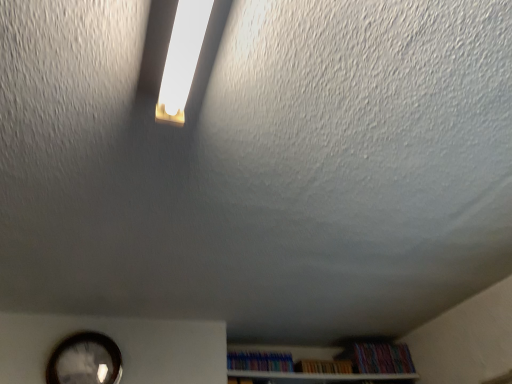
Question: Should I look upward or downward to see multicolored plastic books at lower center, the 1th book from the left?

Choices:
 (A) down
 (B) up

Answer: (A)

Question: Considering the relative sizes of matte black clock at lower left and multicolored paperbacks at lower right, positioned as the 1th book in right-to-left order, in the image provided, is matte black clock at lower left bigger than multicolored paperbacks at lower right, positioned as the 1th book in right-to-left order,?

Choices:
 (A) yes
 (B) no

Answer: (B)

Question: Is matte black clock at lower left completely or partially outside of multicolored paperbacks at lower right, which appears as the 3th book when viewed from the left?

Choices:
 (A) yes
 (B) no

Answer: (A)

Question: Considering the relative positions of matte black clock at lower left and multicolored paperbacks at lower right, which appears as the 3th book when viewed from the left, in the image provided, is matte black clock at lower left to the left of multicolored paperbacks at lower right, which appears as the 3th book when viewed from the left, from the viewer's perspective?

Choices:
 (A) no
 (B) yes

Answer: (B)

Question: From a real-world perspective, is matte black clock at lower left below multicolored paperbacks at lower right, which appears as the 3th book when viewed from the left?

Choices:
 (A) yes
 (B) no

Answer: (A)

Question: Is matte black clock at lower left touching multicolored paperbacks at lower right, which appears as the 3th book when viewed from the left?

Choices:
 (A) yes
 (B) no

Answer: (B)

Question: Considering the relative sizes of matte black clock at lower left and multicolored paperbacks at lower right, positioned as the 1th book in right-to-left order, in the image provided, is matte black clock at lower left smaller than multicolored paperbacks at lower right, positioned as the 1th book in right-to-left order,?

Choices:
 (A) yes
 (B) no

Answer: (A)

Question: Can you confirm if matte black clock at lower left is thinner than white wooden shelf at lower center?

Choices:
 (A) no
 (B) yes

Answer: (B)

Question: Does matte black clock at lower left have a lesser height compared to white wooden shelf at lower center?

Choices:
 (A) yes
 (B) no

Answer: (B)

Question: Is matte black clock at lower left facing towards white wooden shelf at lower center?

Choices:
 (A) no
 (B) yes

Answer: (A)

Question: Are matte black clock at lower left and white wooden shelf at lower center far apart?

Choices:
 (A) yes
 (B) no

Answer: (B)

Question: Is matte black clock at lower left positioned in front of white wooden shelf at lower center?

Choices:
 (A) yes
 (B) no

Answer: (A)

Question: From the image's perspective, is matte black clock at lower left below white wooden shelf at lower center?

Choices:
 (A) no
 (B) yes

Answer: (A)

Question: From the image's perspective, is multicolored plastic books at lower center, the 1th book from the left, on white wooden shelf at lower center?

Choices:
 (A) yes
 (B) no

Answer: (A)